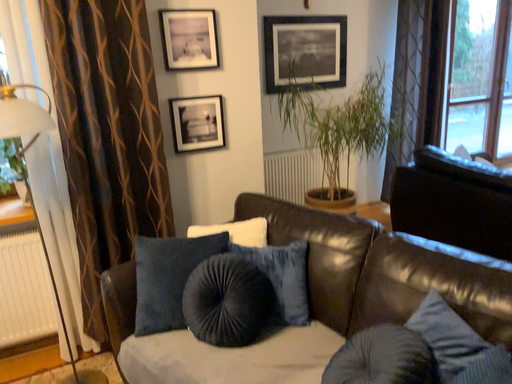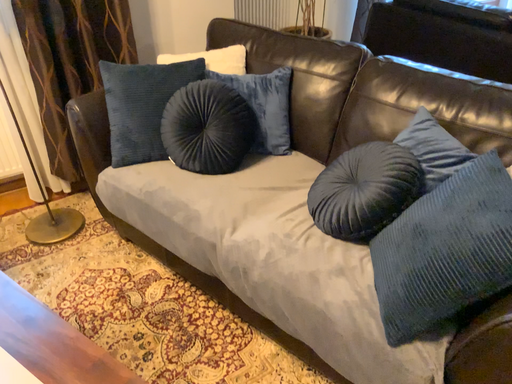
Question: How did the camera likely rotate when shooting the video?

Choices:
 (A) rotated right
 (B) rotated left

Answer: (A)